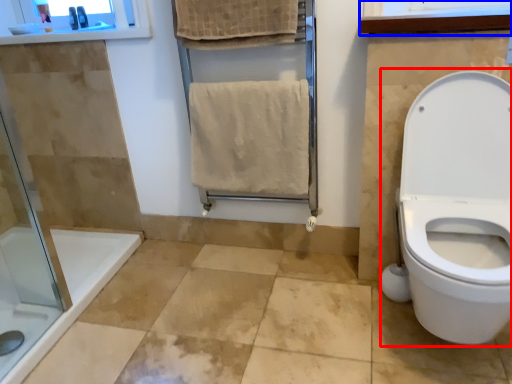
Question: Which point is further to the camera, sit (highlighted by a red box) or medicine cabinet (highlighted by a blue box)?

Choices:
 (A) sit
 (B) medicine cabinet

Answer: (B)